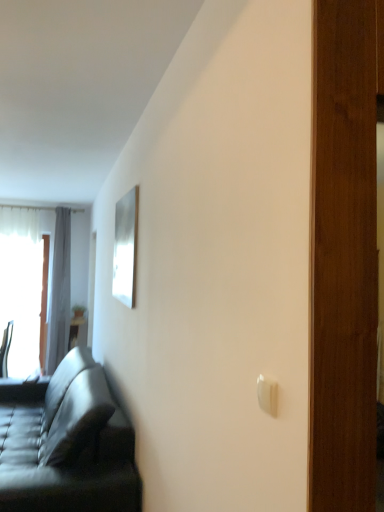
Question: Looking at their shapes, would you say white plastic light switch at lower right is wider or thinner than wooden table at left?

Choices:
 (A) thin
 (B) wide

Answer: (A)

Question: Based on their sizes in the image, would you say white plastic light switch at lower right is bigger or smaller than wooden table at left?

Choices:
 (A) big
 (B) small

Answer: (B)

Question: Considering the real-world distances, which object is closest to the gray fabric curtain at left?

Choices:
 (A) metallic silver chair at left
 (B) leather couch at left
 (C) white plastic light switch at lower right
 (D) white sheer curtain at left
 (E) wooden table at left

Answer: (D)

Question: Considering the real-world distances, which object is closest to the white sheer curtain at left?

Choices:
 (A) wooden table at left
 (B) white plastic light switch at lower right
 (C) leather couch at left
 (D) metallic silver chair at left
 (E) gray fabric curtain at left

Answer: (E)